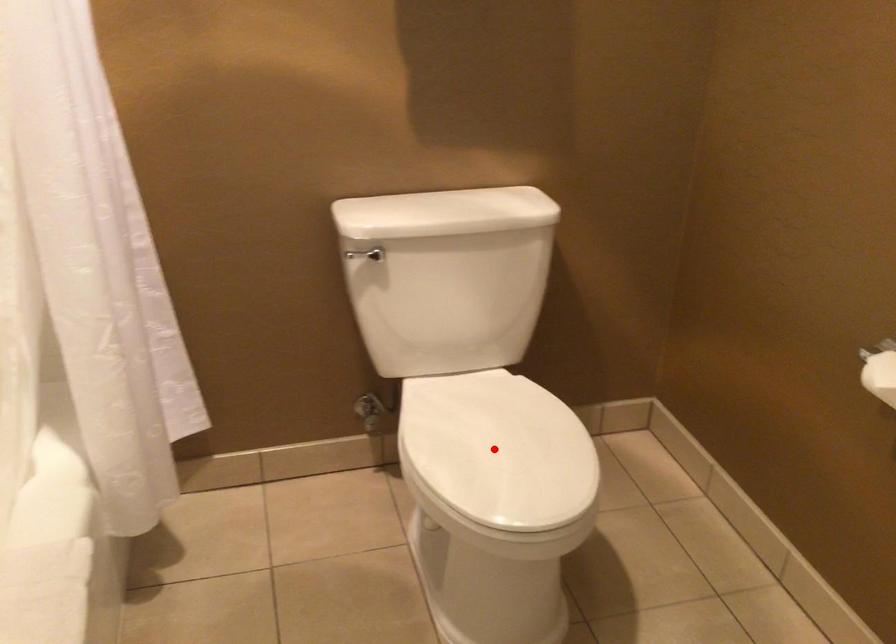
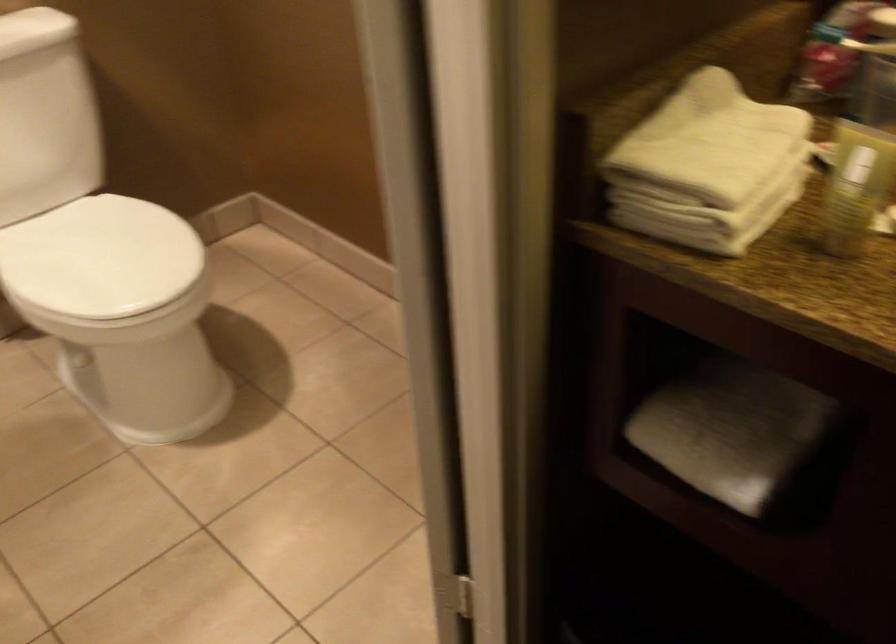
Find the pixel in the second image that matches the highlighted location in the first image.

(99, 257)